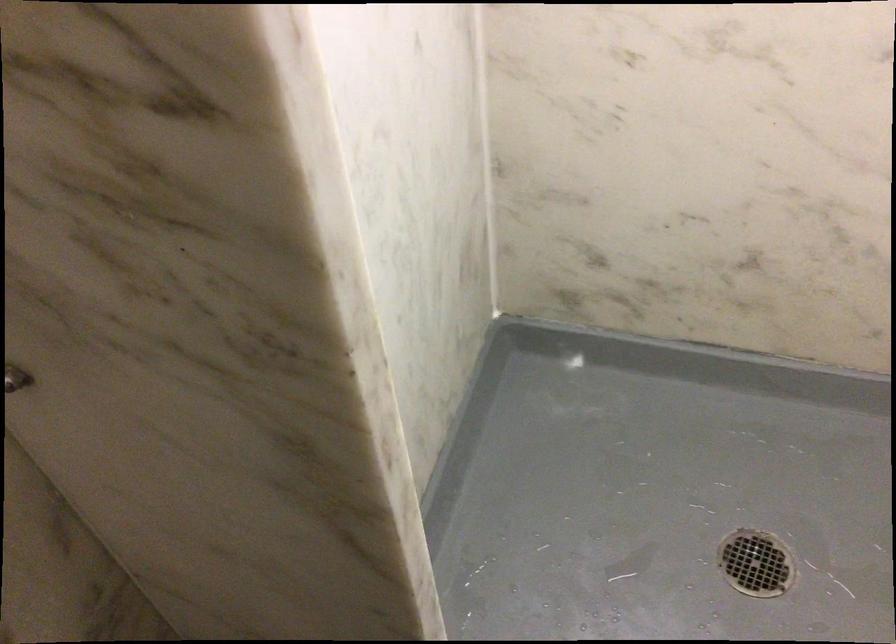
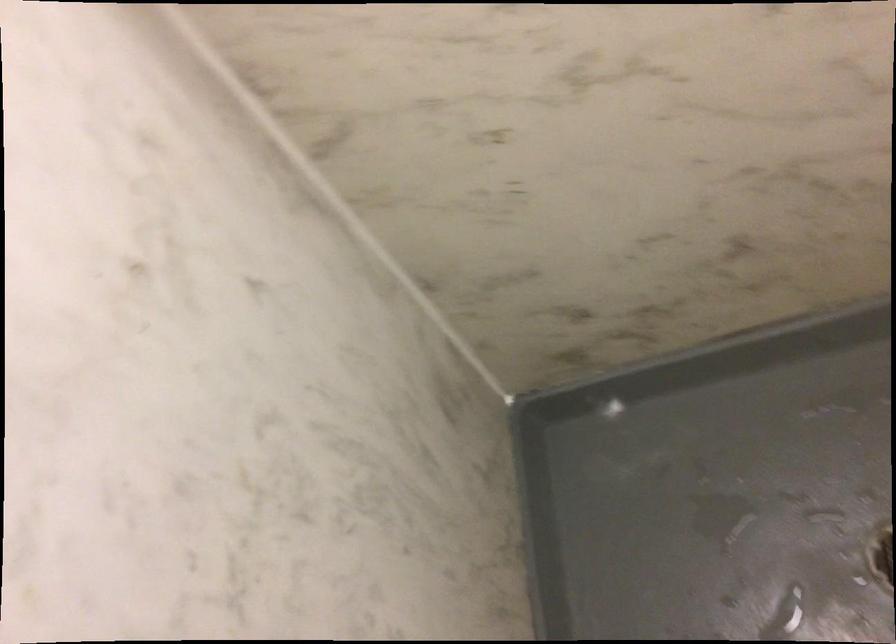
Which direction would the cameraman need to move to produce the second image?

The cameraman moved toward right, forward.